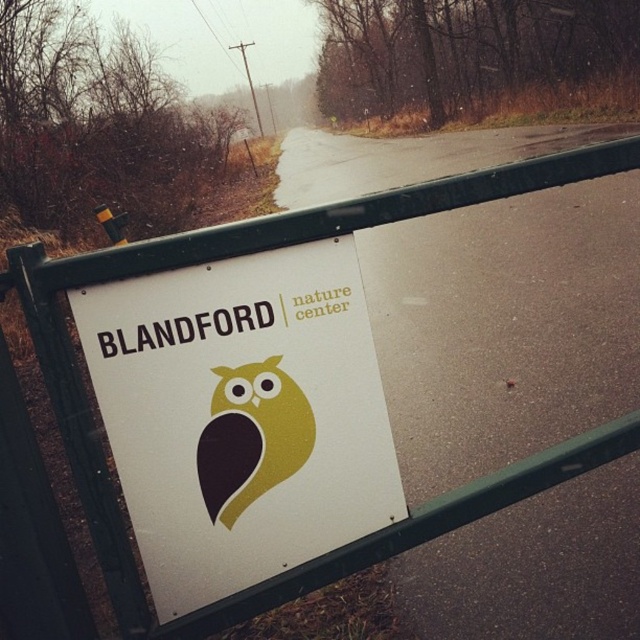
Question: Which point is closer to the camera?

Choices:
 (A) white paper sign at center
 (B) yellow matte/soft owl at center

Answer: (A)

Question: Can you confirm if white paper sign at center is bigger than yellow matte/soft owl at center?

Choices:
 (A) yes
 (B) no

Answer: (A)

Question: Which object is closer to the camera taking this photo?

Choices:
 (A) yellow matte/soft owl at center
 (B) white paper sign at center

Answer: (B)

Question: Can you confirm if white paper sign at center is smaller than yellow matte/soft owl at center?

Choices:
 (A) no
 (B) yes

Answer: (A)

Question: Is white paper sign at center further to the viewer compared to yellow matte/soft owl at center?

Choices:
 (A) no
 (B) yes

Answer: (A)